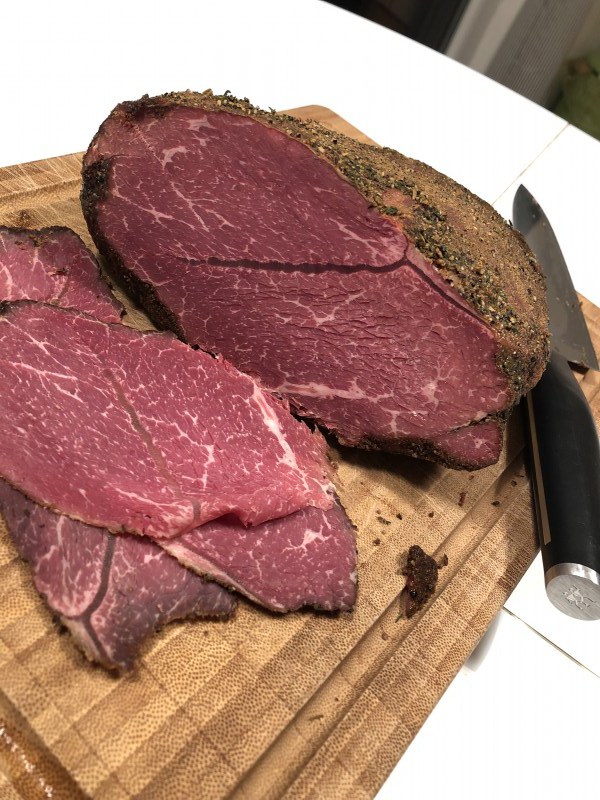
Identify the location of table. This screenshot has width=600, height=800. (52, 709), (542, 470).